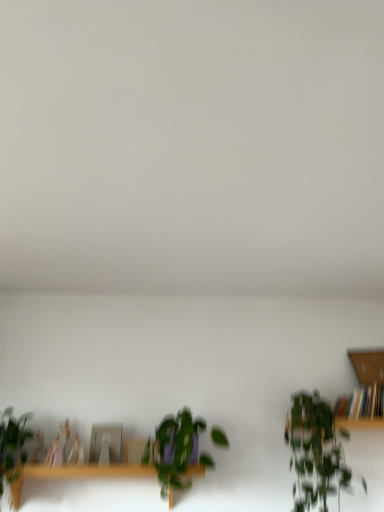
Question: Is wooden bookshelf at right bigger or smaller than wooden table at lower center?

Choices:
 (A) small
 (B) big

Answer: (A)

Question: Looking at their shapes, would you say wooden bookshelf at right is wider or thinner than wooden table at lower center?

Choices:
 (A) wide
 (B) thin

Answer: (B)

Question: Considering the real-world distances, which object is closest to the green leafy plant at right, the third houseplant positioned from the left?

Choices:
 (A) wooden bookshelf at right
 (B) wooden table at lower center
 (C) green matte plant at lower left, which is the third houseplant from right to left
 (D) green leafy plant at center, which appears as the 2th houseplant when viewed from the left

Answer: (A)

Question: Based on their relative distances, which object is nearer to the green matte plant at lower left, which ranks as the first houseplant in left-to-right order?

Choices:
 (A) green leafy plant at center, which appears as the 2th houseplant when viewed from the left
 (B) green leafy plant at right, the third houseplant positioned from the left
 (C) wooden bookshelf at right
 (D) wooden table at lower center

Answer: (D)